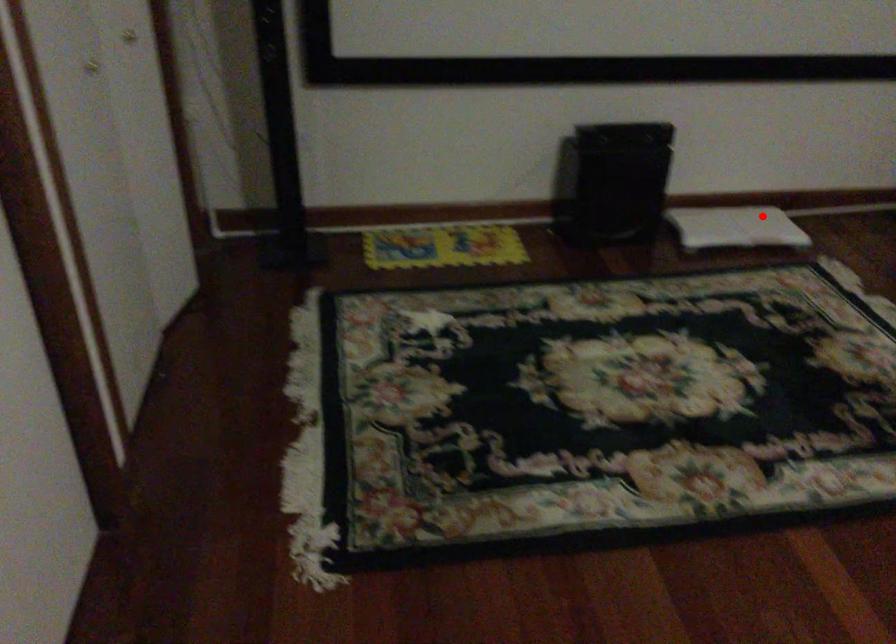
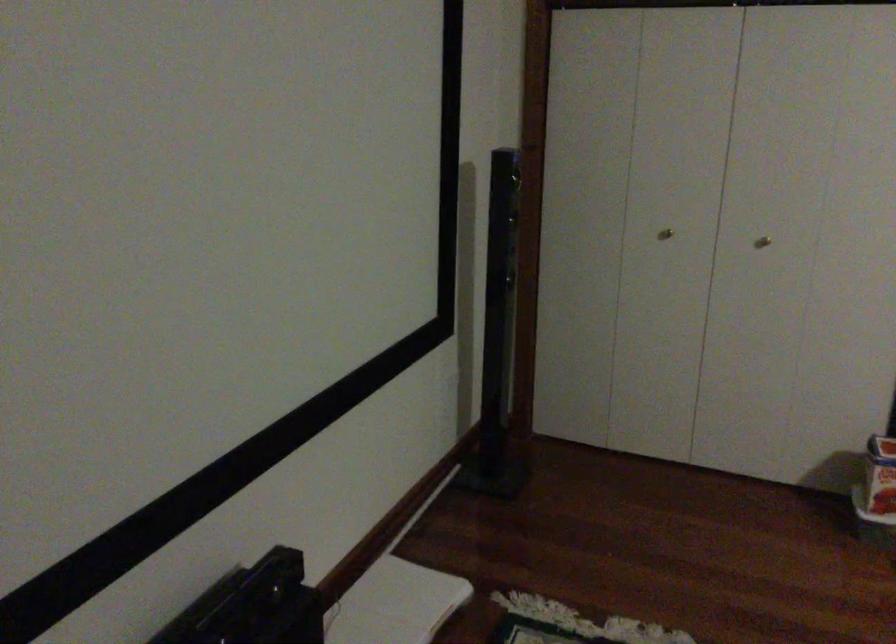
Find the pixel in the second image that matches the highlighted location in the first image.

(394, 603)